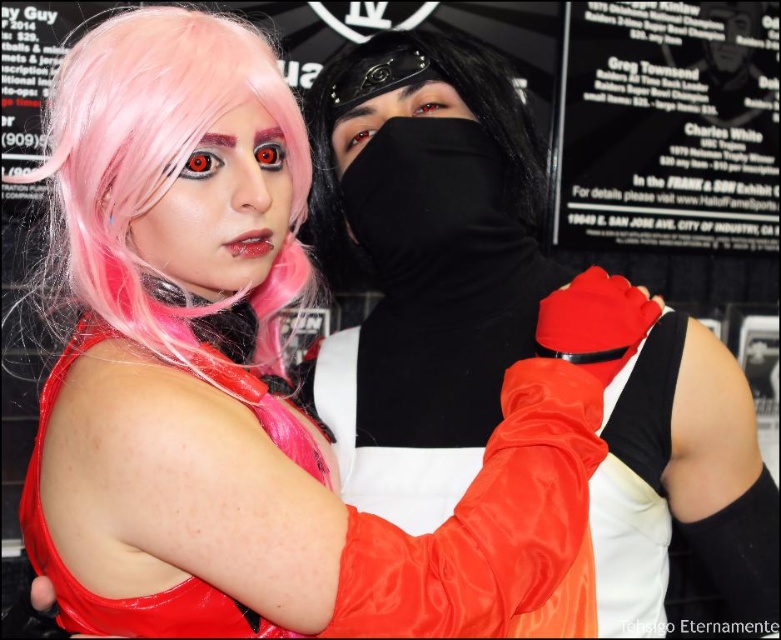
Where is the matte black mask at center located in the image?

The matte black mask at center is located at point [421,262].

You are a photographer setting up for a photoshoot. You need to ensure that the shiny pink wig at center and the matte black mask at center are both visible in the frame. Based on their positions, which object should you adjust to make sure both are fully visible?

The shiny pink wig at center is behind the matte black mask at center. To ensure both are fully visible, you should adjust the position of the shiny pink wig at center so it doesn not get obscured by the matte black mask at center.

You are a photographer setting up a photo shoot for two cosplayers. You need to position the pink silky wig at upper left and the shiny pink wig at center so that both wigs are visible in the frame. Given their sizes, which wig should be placed closer to the camera to ensure both are fully visible?

The pink silky wig at upper left has a larger width than the shiny pink wig at center. To ensure both wigs are fully visible in the frame, the larger pink silky wig at upper left should be placed closer to the camera. This way, the smaller shiny pink wig at center can be positioned further back without being cut off, maintaining visibility for both.